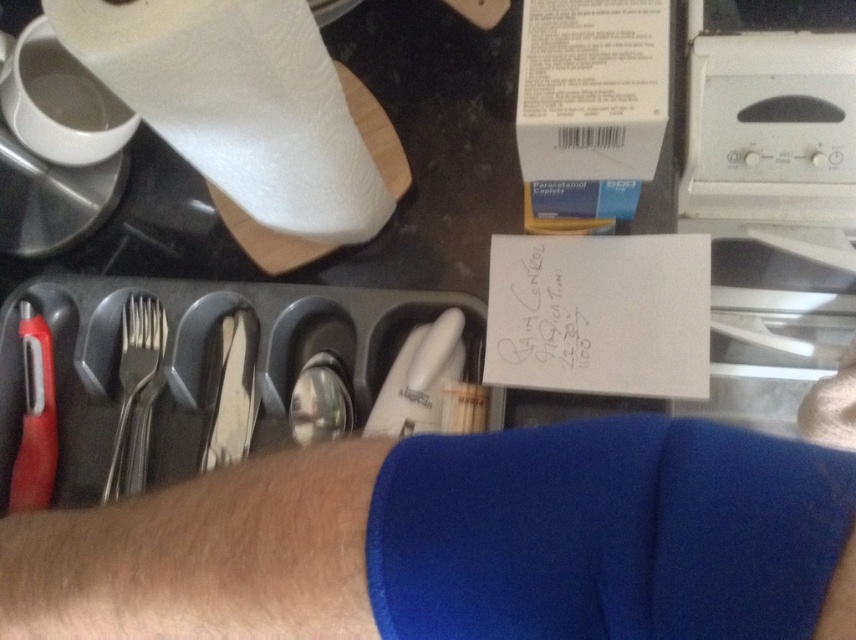
Looking at this image, you are a delivery robot with a height of 3 feet. You need to place a small package on the kitchen countertop shown in the image. The package must be placed at the point labeled as point (131,410). However, there are obstacles on the countertop. Can you determine if the package will be visible to someone standing at the camera position after placement?

The point (131,410) is 27.23 inches away from the camera. Since the delivery robot is 3 feet tall, which is 36 inches, the package placed at that point would be within the camera view as the distance is shorter than the robot height. Therefore, the package will be visible to someone standing at the camera position.

You are holding a 12 inch ruler and want to measure the distance between the point at coordinates point (122, 36) and the camera. Can your ruler reach that distance?

The distance between point (122, 36) and the camera is 16.93 inches. Since the ruler is only 12 inches long, it cannot reach the full distance. You would need a longer measuring tool.

You are organizing the kitchen and see the satin silver fork at left and the satin silverware at center. Which one is closer to the white paper with handwritten text?

The satin silverware at center is closer to the white paper with handwritten text because it is positioned between the satin silver fork at left and the paper.